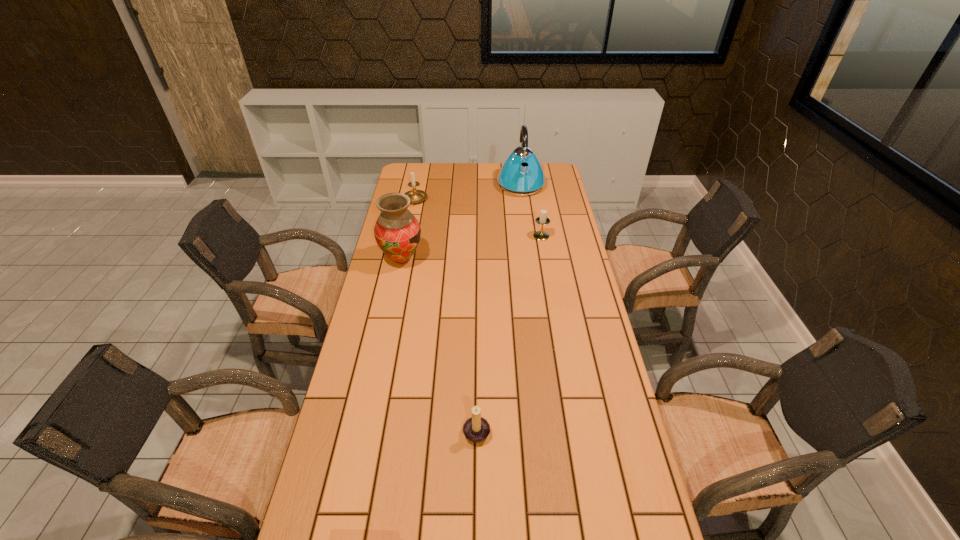
The height and width of the screenshot is (540, 960). Identify the location of kettle. (521, 174).

Locate an element on the screen. Image resolution: width=960 pixels, height=540 pixels. the second nearest object is located at coordinates (397, 232).

Find the location of a particular element. This screenshot has height=540, width=960. the leftmost candle holder is located at coordinates (415, 195).

Where is `the second farthest candle holder`? Image resolution: width=960 pixels, height=540 pixels. the second farthest candle holder is located at coordinates tap(542, 220).

At what (x,y) coordinates should I click in order to perform the action: click on the third farthest object. Please return your answer as a coordinate pair (x, y). The image size is (960, 540). Looking at the image, I should click on (542, 220).

Identify the location of the nearest object. pyautogui.click(x=476, y=429).

Identify the location of the third object from left to right. This screenshot has height=540, width=960. (476, 429).

Find the location of a particular element. This screenshot has width=960, height=540. free region located at the spout of the kettle is located at coordinates (525, 216).

Find the location of a particular element. free space located on the front of the vase is located at coordinates (394, 295).

The width and height of the screenshot is (960, 540). Find the location of `vacant point located 0.230m with a handle on the side of the leftmost candle holder`. vacant point located 0.230m with a handle on the side of the leftmost candle holder is located at coordinates (407, 239).